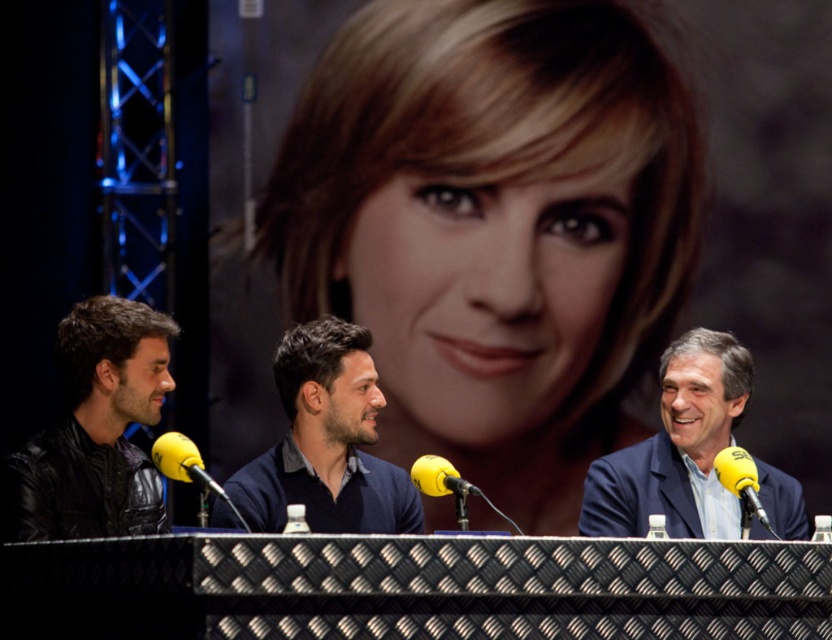
Question: Which object is the farthest from the yellow foam microphone at right?

Choices:
 (A) blue fabric suit at right
 (B) black leather jacket at left

Answer: (B)

Question: Which point appears closest to the camera in this image?

Choices:
 (A) (721, 451)
 (B) (662, 120)
 (C) (77, 515)

Answer: (C)

Question: Does smooth skin face at center have a larger size compared to blue fabric suit at right?

Choices:
 (A) no
 (B) yes

Answer: (B)

Question: Can you confirm if yellow foam microphone at center is smaller than yellow foam microphone at right?

Choices:
 (A) no
 (B) yes

Answer: (A)

Question: Considering the real-world distances, which object is farthest from the smooth skin face at center?

Choices:
 (A) yellow foam microphone at right
 (B) blue fabric suit at right
 (C) dark blue sweater at center
 (D) yellow matte microphone at center

Answer: (D)

Question: From the image, what is the correct spatial relationship of black leather jacket at left in relation to dark blue sweater at center?

Choices:
 (A) above
 (B) below

Answer: (A)